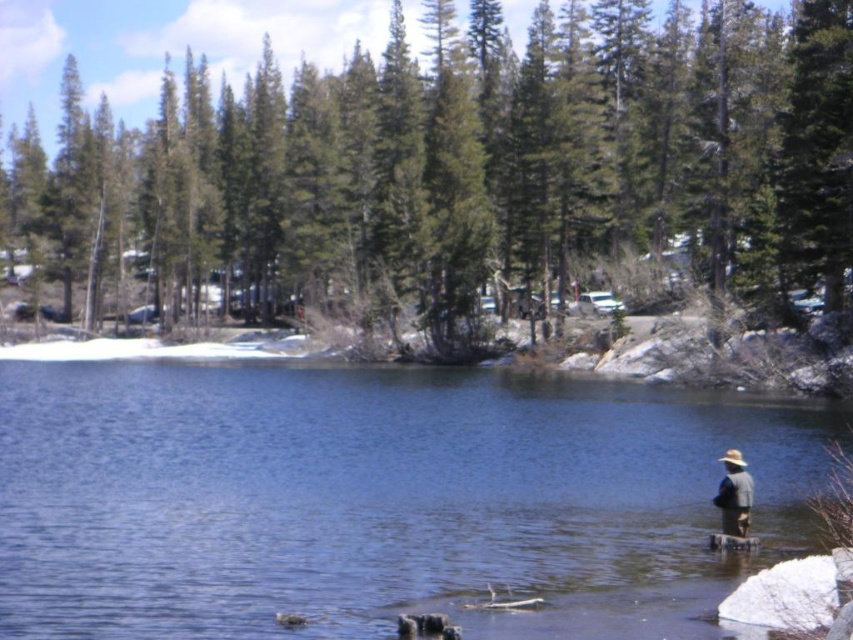
You are standing at the point marked as point (x=376, y=499) and want to cast your fishing line into the blue water at center. Which direction should you cast your line to reach the blue water at center?

The blue water at center is located at point (x=376, y=499), so you should cast your line directly towards that point to reach the blue water at center.

You are a bird flying over the serene outdoor scene. You see the green textured pine trees at upper center and the blue water at center. Which object is located above the other?

The green textured pine trees at upper center are positioned over the blue water at center, meaning they are above it.